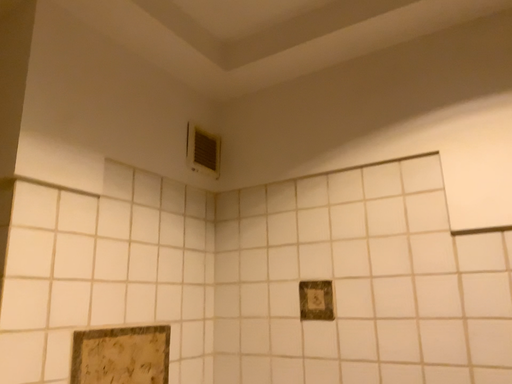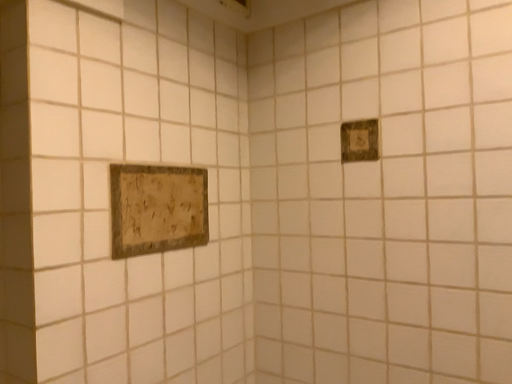
Question: How did the camera likely rotate when shooting the video?

Choices:
 (A) rotated upward
 (B) rotated downward

Answer: (B)